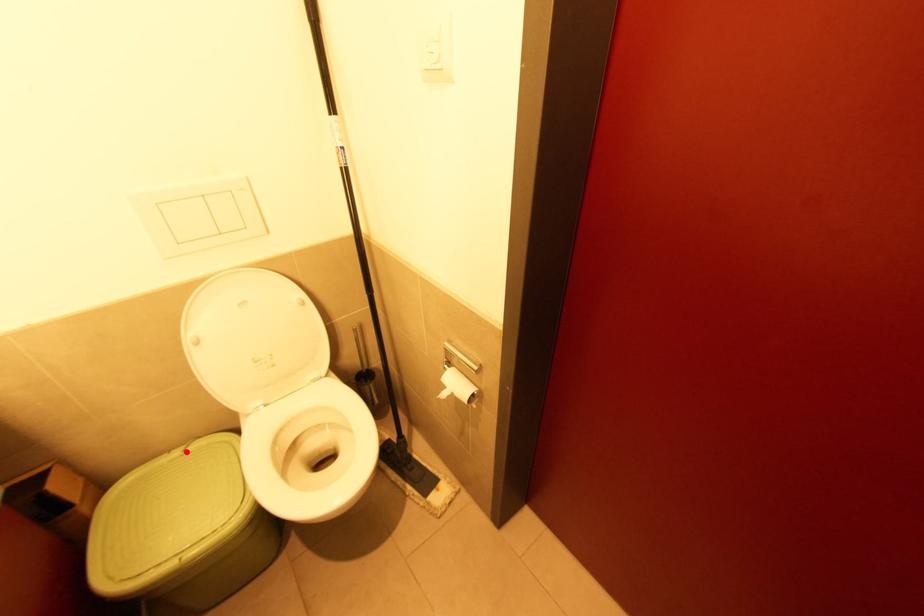
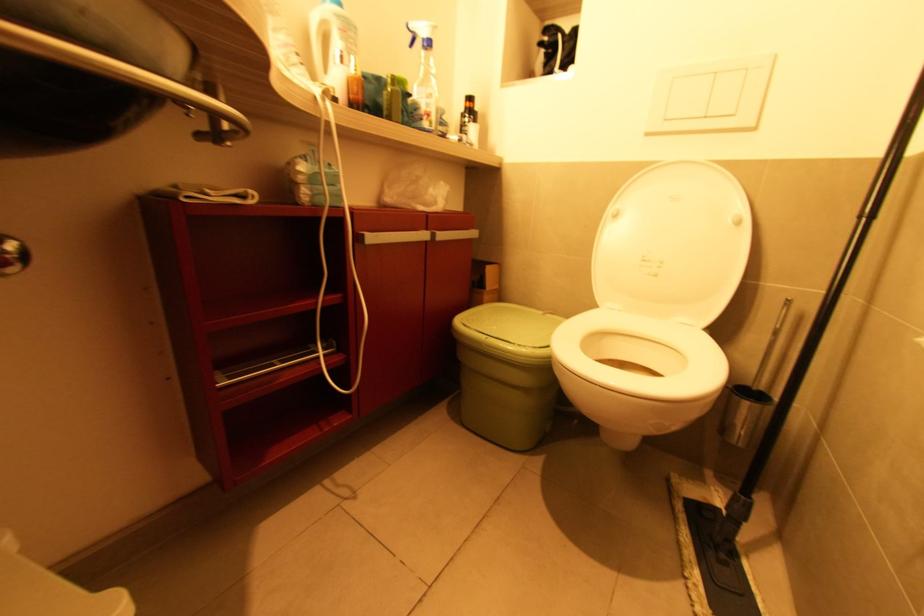
Question: I am providing you with two images of the same scene from different viewpoints. A red point is marked on the first image. At the location where the point appears in image 1, is it still visible in image 2?

Choices:
 (A) Yes
 (B) No

Answer: (A)